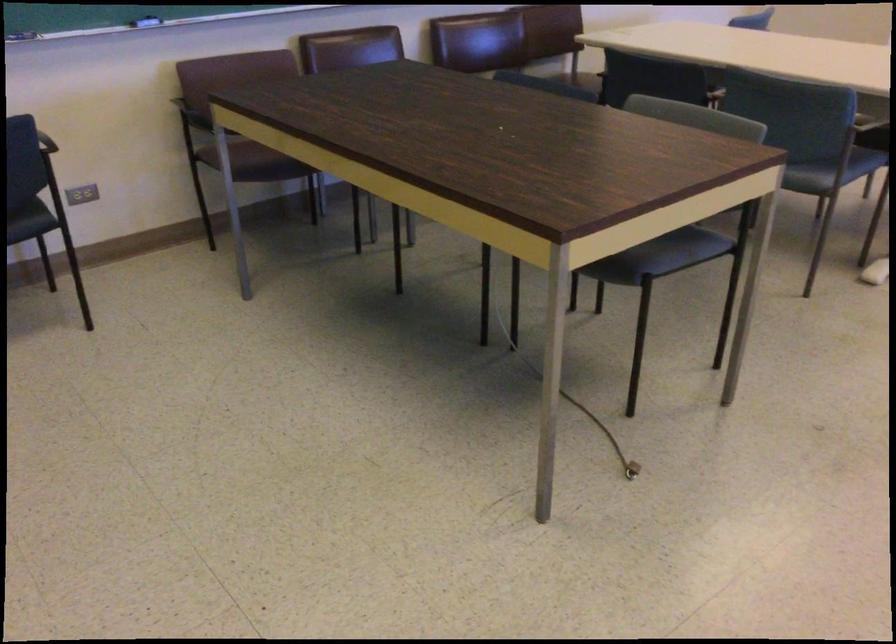
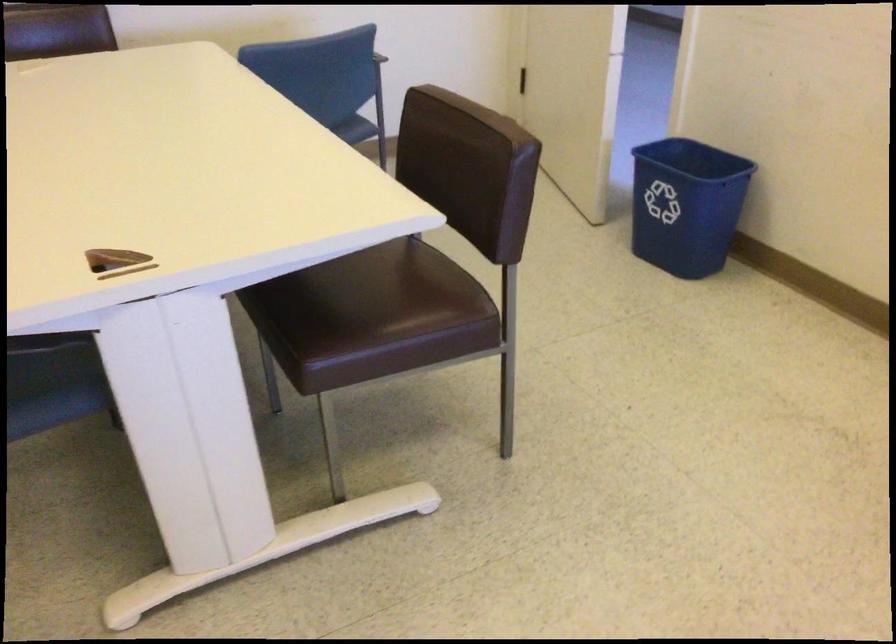
Consider the image. What movement of the cameraman would produce the second image?

The movement direction of the cameraman is right, forward.